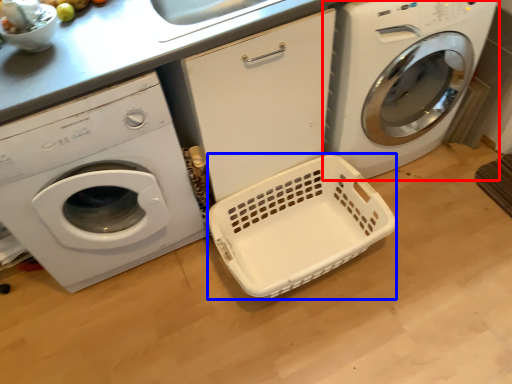
Question: Which of the following is the closest to the observer, washing machine (highlighted by a red box) or basket container (highlighted by a blue box)?

Choices:
 (A) washing machine
 (B) basket container

Answer: (A)